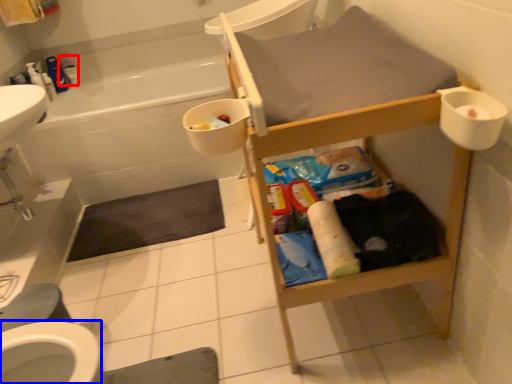
Question: Which of the following is the farthest to the observer, toiletry (highlighted by a red box) or bidet (highlighted by a blue box)?

Choices:
 (A) toiletry
 (B) bidet

Answer: (A)